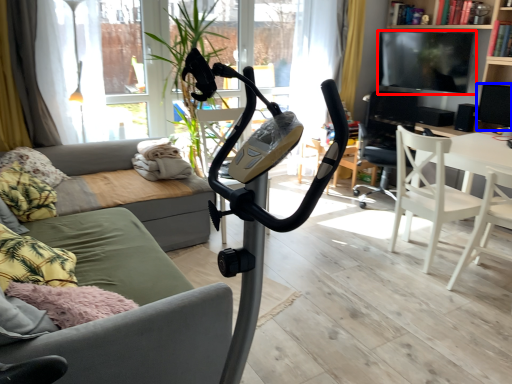
Question: Which object appears closest to the camera in this image, television (highlighted by a red box) or speaker (highlighted by a blue box)?

Choices:
 (A) television
 (B) speaker

Answer: (B)